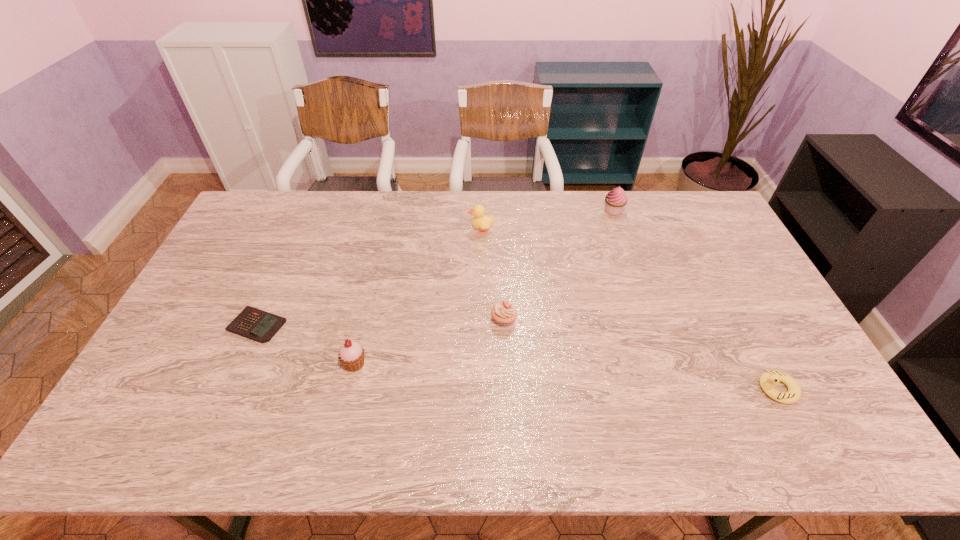
Locate an element on the screen. the rightmost cupcake is located at coordinates (616, 199).

Find the location of a particular element. This screenshot has width=960, height=540. the second object from right to left is located at coordinates (616, 199).

Locate an element on the screen. The width and height of the screenshot is (960, 540). the taller duckling is located at coordinates (480, 221).

The image size is (960, 540). In order to click on the farther duckling in this screenshot , I will do coord(480,221).

The image size is (960, 540). I want to click on the second object from left to right, so click(x=351, y=354).

Locate an element on the screen. Image resolution: width=960 pixels, height=540 pixels. the leftmost cupcake is located at coordinates (351, 354).

Find the location of a particular element. This screenshot has height=540, width=960. the second farthest cupcake is located at coordinates (504, 312).

Find the location of a particular element. The height and width of the screenshot is (540, 960). the shorter duckling is located at coordinates (769, 379).

Identify the location of the second shortest object. The width and height of the screenshot is (960, 540). (769, 379).

Find the location of a particular element. the leftmost object is located at coordinates (252, 323).